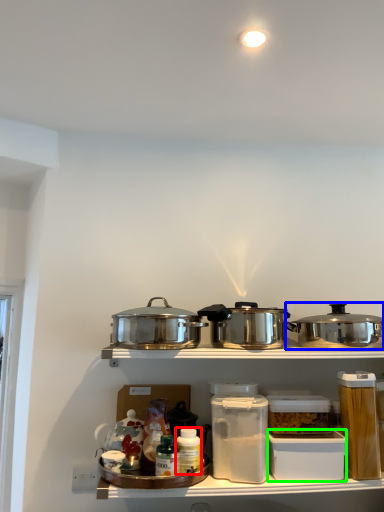
Question: Estimate the real-world distances between objects in this image. Which object is closer to bottle (highlighted by a red box), kitchen appliance (highlighted by a blue box) or box (highlighted by a green box)?

Choices:
 (A) kitchen appliance
 (B) box

Answer: (B)